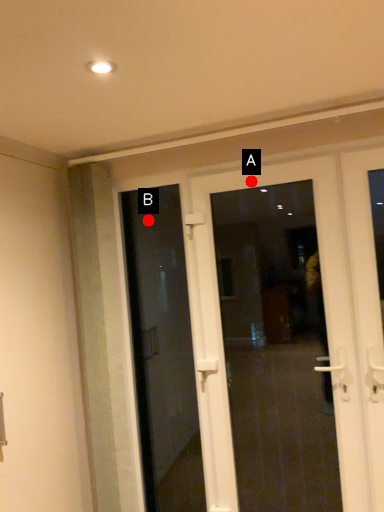
Question: Two points are circled on the image, labeled by A and B beside each circle. Which point is closer to the camera?

Choices:
 (A) A is closer
 (B) B is closer

Answer: (A)